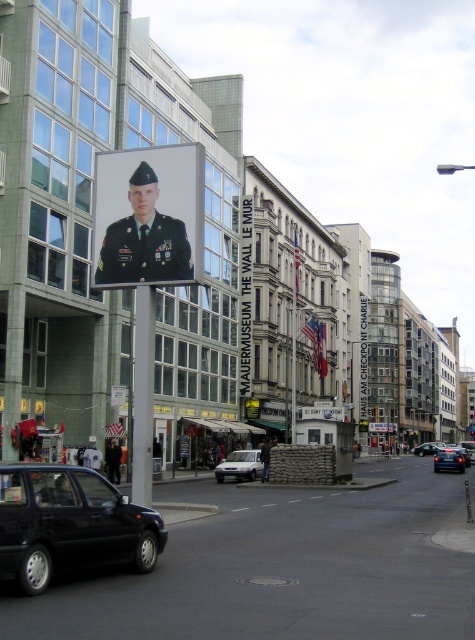
You are a photographer standing at Checkpoint Charlie in Berlin. You want to take a photo of the metallic pole at center without the shiny black car at lower left appearing in the frame. Is the car too tall to block the pole in your photo?

The shiny black car at lower left is not as tall as the metallic pole at center, so the car is shorter and less likely to block the pole in the photo.

You are a tour guide in Berlin and need to park your vehicle between the white matte van at center and the blue metallic sedan at center. Which vehicle should you park behind to ensure you are in the correct spot?

You should park behind the white matte van at center because it is smaller in size compared to the blue metallic sedan at center, so there might be more space available behind it.

You are a tourist standing at Checkpoint Charlie in Berlin, and you see a white matte van at center and a blue metallic sedan at center. Which vehicle is closer to the left side of the street?

The white matte van at center is positioned on the left side of the blue metallic sedan at center, so it is closer to the left side of the street.